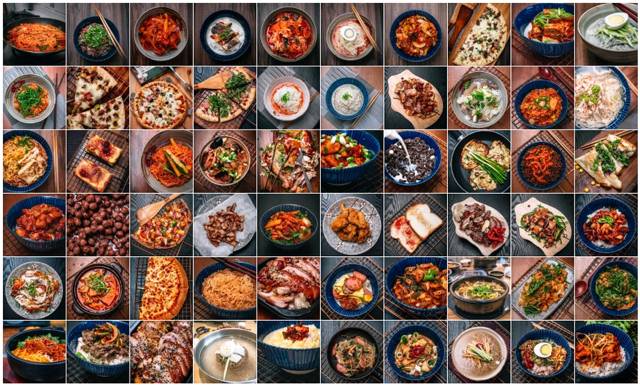
Where is `columns`? The image size is (640, 385). columns is located at coordinates (41, 38), (77, 30), (154, 33), (243, 33), (289, 31), (344, 30), (403, 34), (472, 31), (552, 34), (608, 29).